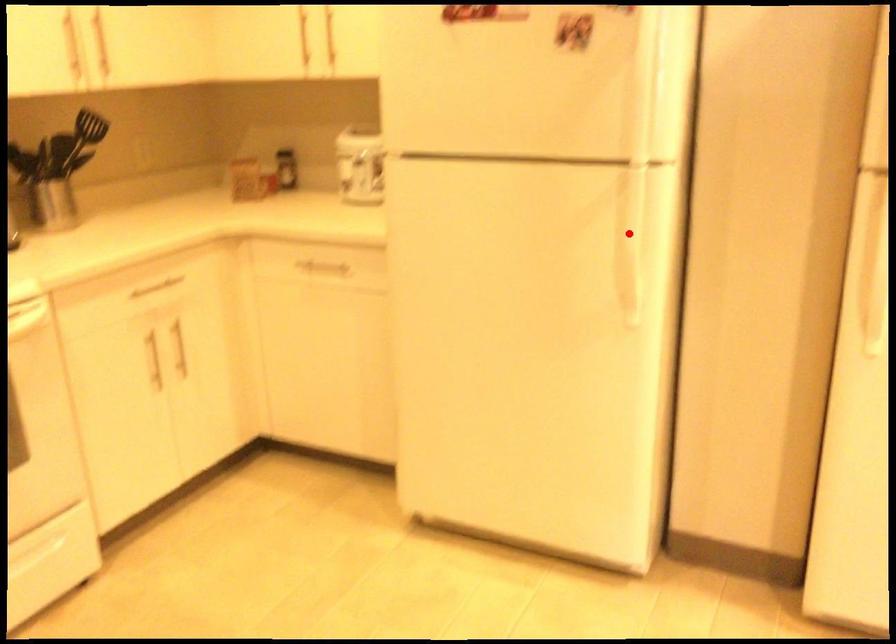
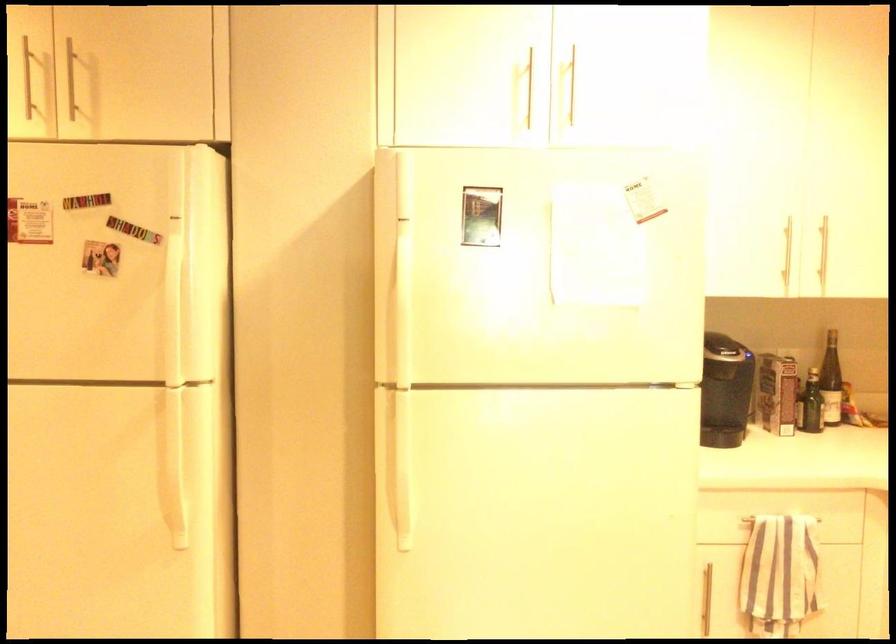
The point at the highlighted location is marked in the first image. Where is the corresponding point in the second image?

(170, 453)